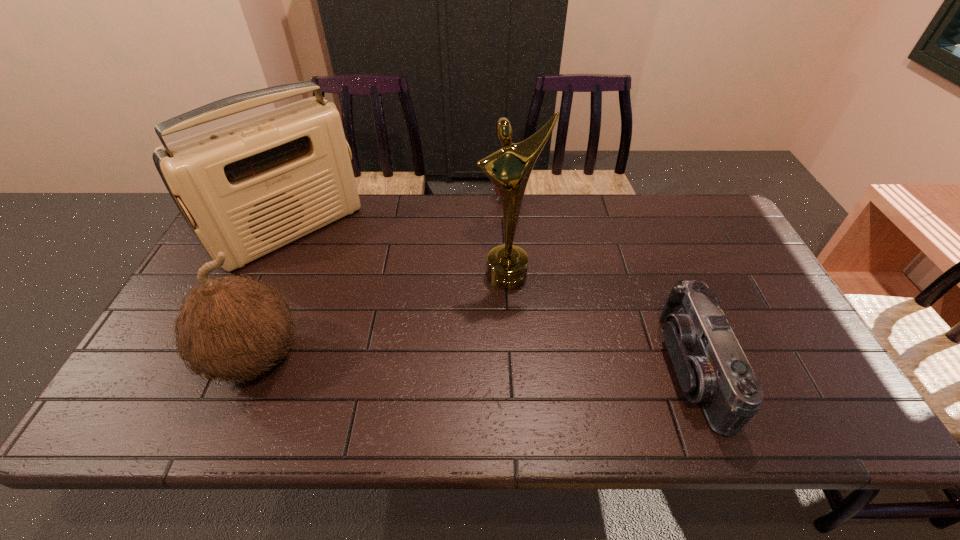
Find the location of `vacant area that satisfies the following two spatial constraints: 1. on the surface of the coconut; 2. on the front-facing side of the rightmost object`. vacant area that satisfies the following two spatial constraints: 1. on the surface of the coconut; 2. on the front-facing side of the rightmost object is located at coordinates (250, 369).